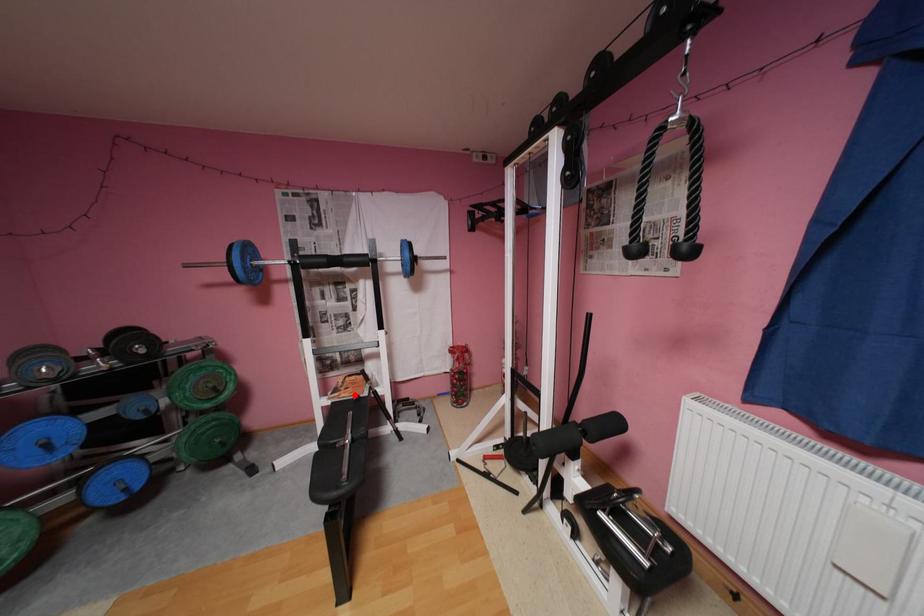
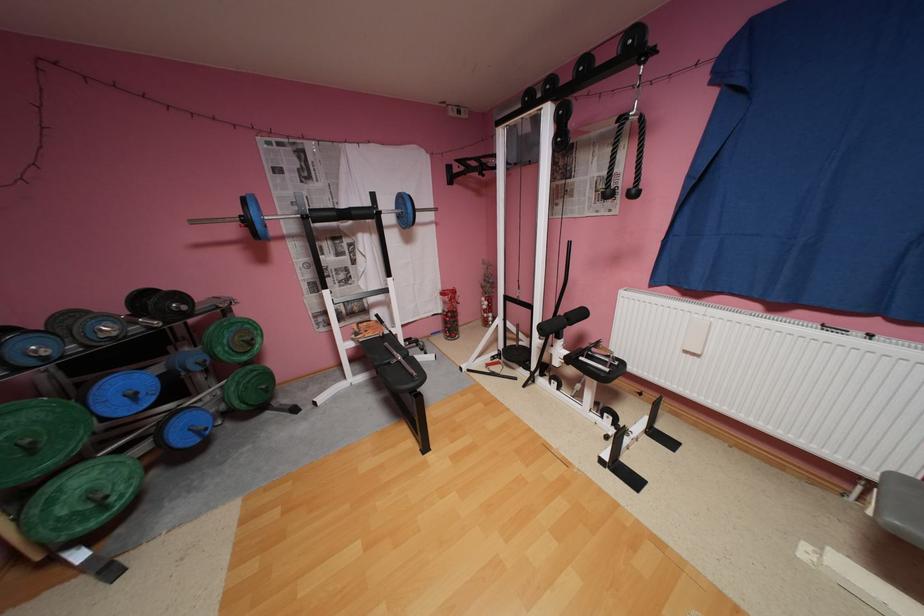
The point at the highlighted location is marked in the first image. Where is the corresponding point in the second image?

(380, 334)